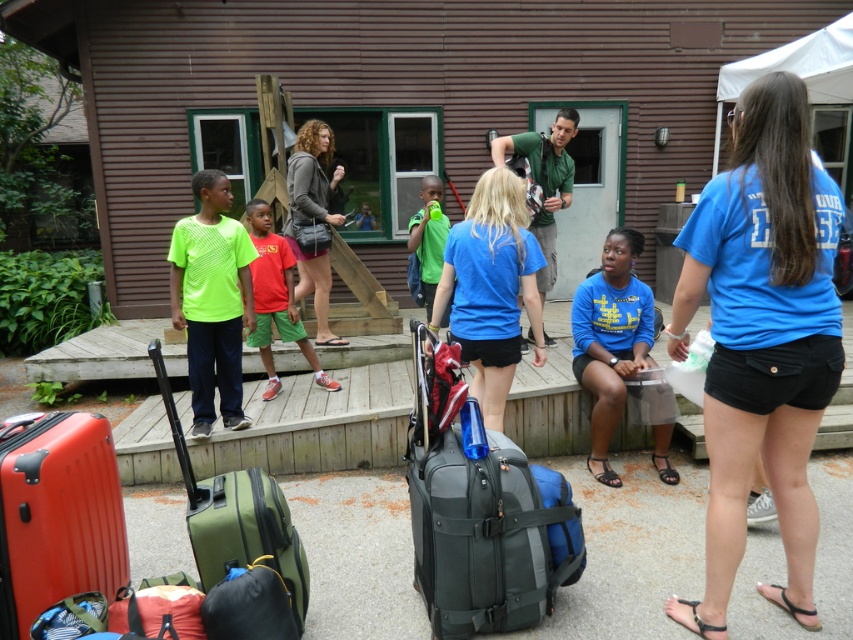
Between blue cotton shirt at center and blue matte shirt at center, which one has less height?

With less height is blue matte shirt at center.

Can you confirm if blue cotton shirt at center is positioned below blue matte shirt at center?

Indeed, blue cotton shirt at center is positioned under blue matte shirt at center.

Measure the distance between point (779, 145) and camera.

2.61 meters

Locate an element on the screen. The height and width of the screenshot is (640, 853). blue cotton shirt at center is located at coordinates (762, 339).

Is point (421, 566) farther from camera compared to point (445, 218)?

No, (421, 566) is closer to viewer.

Is gray fabric suitcase at center bigger than green matte shirt at center?

Indeed, gray fabric suitcase at center has a larger size compared to green matte shirt at center.

Where is `gray fabric suitcase at center`? The width and height of the screenshot is (853, 640). gray fabric suitcase at center is located at coordinates (479, 512).

Can you confirm if blue matte shirt at center is wider than neon green mesh shirt at center?

Correct, the width of blue matte shirt at center exceeds that of neon green mesh shirt at center.

Can you confirm if blue matte shirt at center is positioned to the right of neon green mesh shirt at center?

Indeed, blue matte shirt at center is positioned on the right side of neon green mesh shirt at center.

Is point (498, 356) more distant than point (224, 257)?

No, (498, 356) is closer to viewer.

This screenshot has height=640, width=853. Identify the location of blue matte shirt at center. (491, 288).